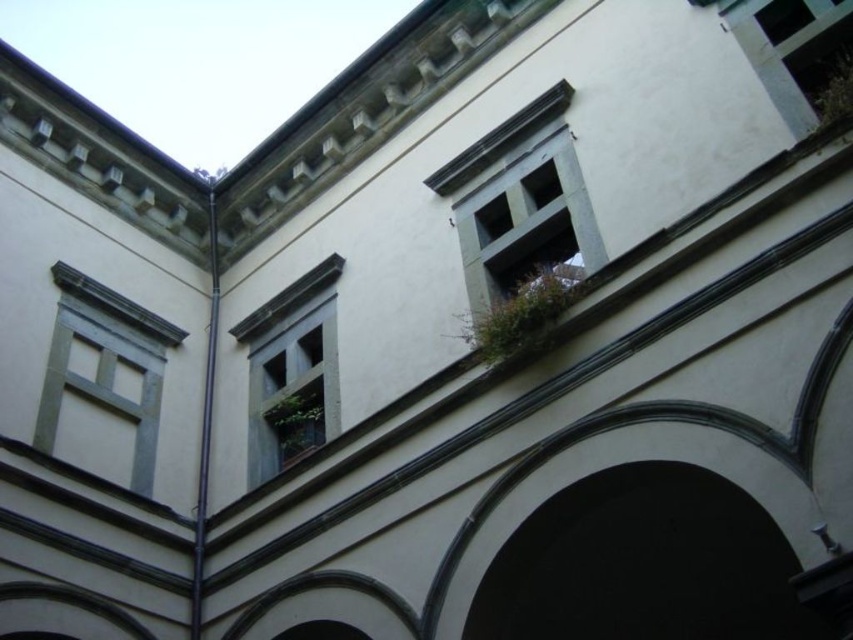
You are an architect examining the classical building. You notice the gray stone window at upper center and the matte gray window at upper left. Which window is closer to you from your current viewpoint?

The gray stone window at upper center is closer to you because it is in front of the matte gray window at upper left.

You are standing in the classical building and want to move from point A to point B. Given that point A is at coordinates point (515, 150) and point B is at coordinates point (105, 419), which direction should you move to get closer to point B?

To move from point A at coordinates point (515, 150) to point B at coordinates point (105, 419), you should move downward and to the right since point B is located below and to the right of point A.

You are an architect analyzing the building structure. You need to determine which window has a smaller height between the matte gray window at upper left and the blue painted wood window at center. Which one is it?

The matte gray window at upper left has a lesser height compared to the blue painted wood window at center, so the matte gray window at upper left is the smaller one in height.